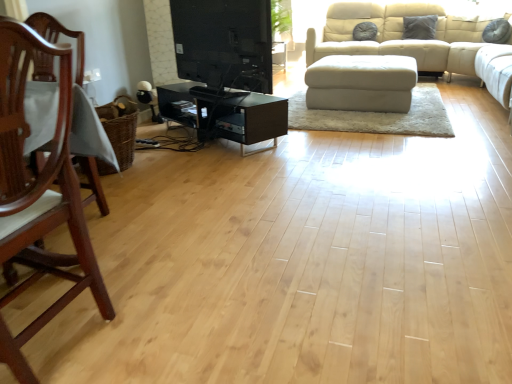
Question: Is black glossy tv stand at center wider or thinner than black glass tv stand at center?

Choices:
 (A) thin
 (B) wide

Answer: (A)

Question: Does point (238, 3) appear closer or farther from the camera than point (272, 117)?

Choices:
 (A) farther
 (B) closer

Answer: (B)

Question: Estimate the real-world distances between objects in this image. Which object is closer to the black glass tv stand at center?

Choices:
 (A) black glossy tv stand at center
 (B) mahogany wood chair at left
 (C) white fabric ottoman at center

Answer: (A)

Question: Considering the real-world distances, which object is closest to the mahogany wood chair at left?

Choices:
 (A) black glossy tv stand at center
 (B) black glass tv stand at center
 (C) white fabric ottoman at center

Answer: (B)